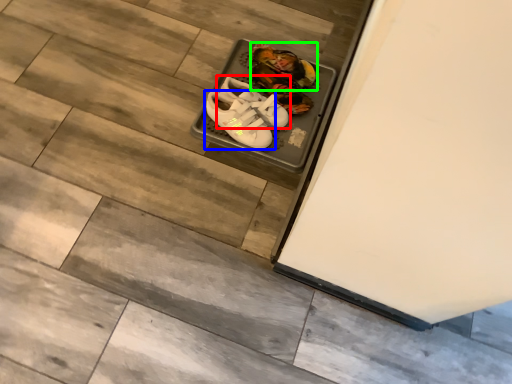
Question: Which object is the farthest from footwear (highlighted by a red box)? Choose among these: footwear (highlighted by a blue box) or footwear (highlighted by a green box).

Choices:
 (A) footwear
 (B) footwear

Answer: (B)